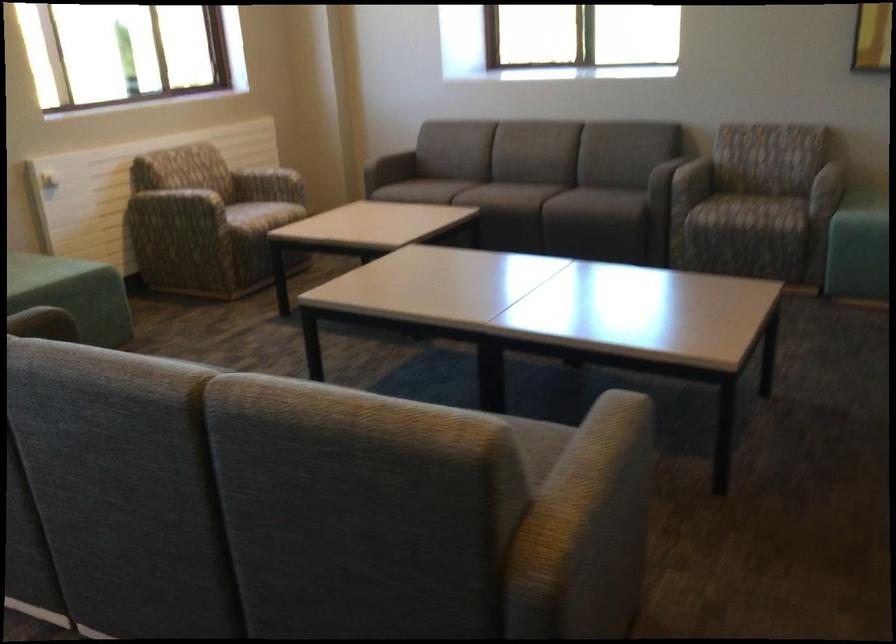
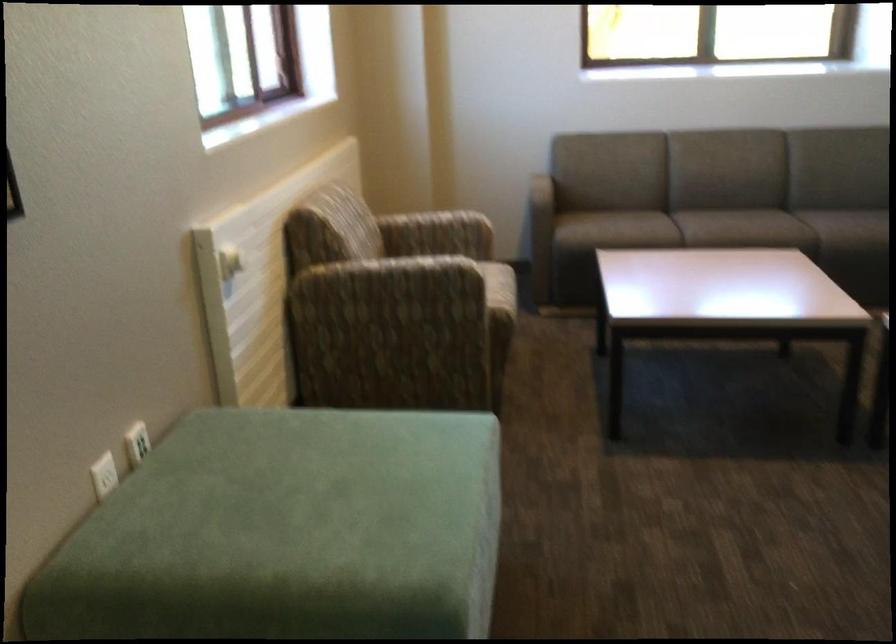
The point at (253,183) is marked in the first image. Where is the corresponding point in the second image?

(436, 234)